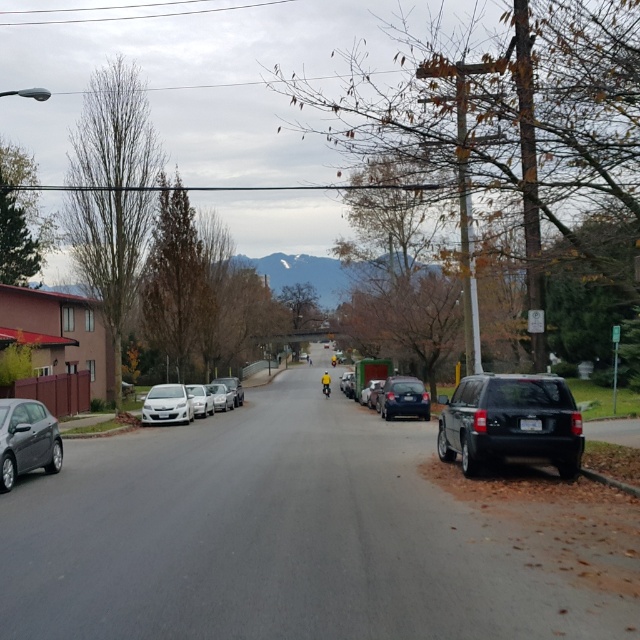
Does matte black car at left have a greater width compared to matte black car at center?

No.

Who is taller, matte black car at left or matte black car at center?

With more height is matte black car at center.

Is point (54, 465) behind point (342, 392)?

No.

Locate an element on the screen. Image resolution: width=640 pixels, height=640 pixels. matte black car at left is located at coordinates (26, 440).

Which of these two, white matte sedan at center or matte black car at center, stands taller?

Standing taller between the two is matte black car at center.

Does white matte sedan at center appear on the right side of matte black car at center?

In fact, white matte sedan at center is to the left of matte black car at center.

Identify the location of white matte sedan at center. (221, 396).

Between black matte suv at right and matte black car at left, which one has less height?

With less height is matte black car at left.

Which is below, black matte suv at right or matte black car at left?

black matte suv at right

This screenshot has width=640, height=640. What are the coordinates of `black matte suv at right` in the screenshot? It's located at (509, 422).